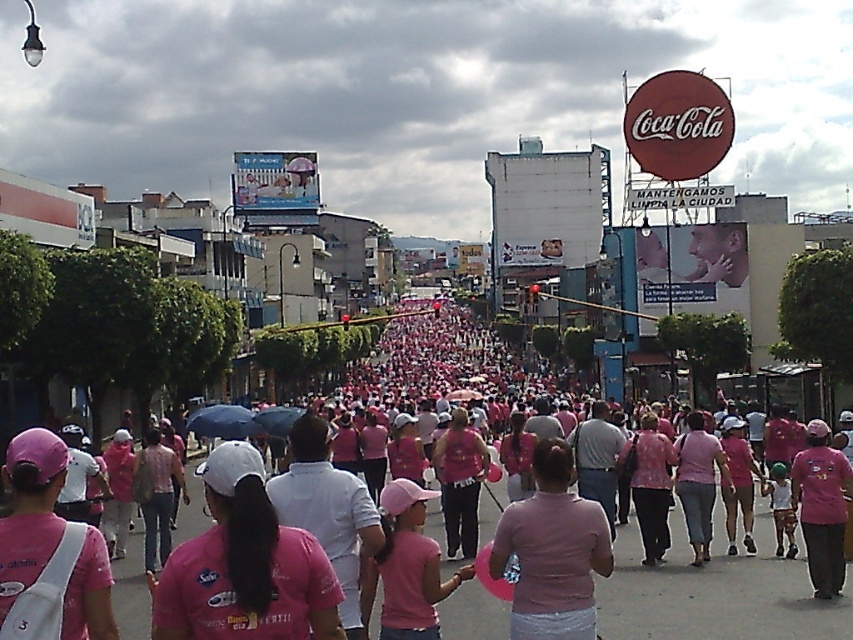
Who is positioned more to the left, pink matte shirt at center or matte pink shirt at center?

matte pink shirt at center is more to the left.

The height and width of the screenshot is (640, 853). I want to click on pink matte shirt at center, so click(552, 552).

Find the location of a particular element. This screenshot has height=640, width=853. pink matte shirt at center is located at coordinates (552, 552).

Between point (625, 550) and point (189, 420), which one is positioned behind?

The point (189, 420) is more distant.

The height and width of the screenshot is (640, 853). I want to click on pink fabric shirts at center, so click(x=717, y=589).

Find the location of `pink fabric shirts at center`. pink fabric shirts at center is located at coordinates (717, 589).

Does pink fabric shirts at center appear on the left side of pink matte shirt at center?

Indeed, pink fabric shirts at center is positioned on the left side of pink matte shirt at center.

Is pink fabric shirts at center thinner than pink matte shirt at center?

No.

What do you see at coordinates (717, 589) in the screenshot? I see `pink fabric shirts at center` at bounding box center [717, 589].

Locate an element on the screen. Image resolution: width=853 pixels, height=640 pixels. pink fabric shirts at center is located at coordinates click(x=717, y=589).